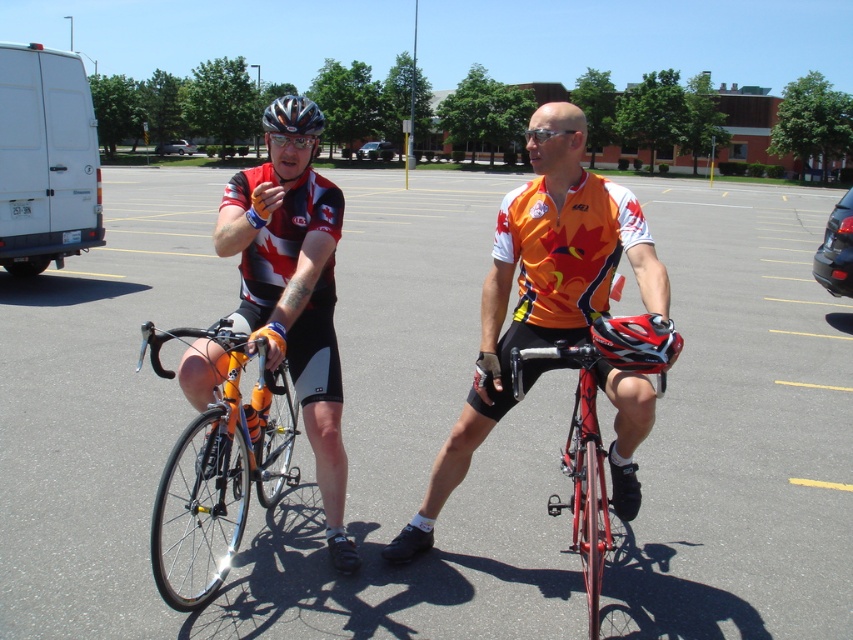
You are a photographer trying to capture a closeup shot of the orange jersey at center and the matte black helmet at center. Which object should you zoom in on to ensure it fills the frame more without moving the camera?

The matte black helmet at center should be zoomed in on because it occupies more space than the orange jersey at center, allowing it to fill the frame better without moving the camera.

You are a photographer at the event and need to capture a photo where both the orange jersey at center and the matte black helmet at center are visible. Based on their sizes, which object should you focus on to ensure both are in frame?

The orange jersey at center is not as tall as the matte black helmet at center, so focusing on the matte black helmet at center would ensure both are visible since it is taller and can help frame the composition with the shorter orange jersey at center.

You are standing in the parking lot and want to know which of the two points, point [527,317] or point [306,118], is closer to you. Based on the scene description, which point is nearer?

Point [527,317] is closer to you because it is further to the viewer than point [306,118].